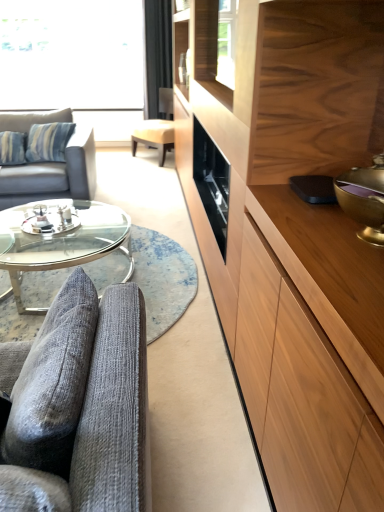
In order to face wooden cabinet at right, should I rotate leftwards or rightwards?

Turn right approximately 5.793 degrees to face it.

Measure the distance between blue striped fabric couch at left, marked as the 1th studio couch in a left-to-right arrangement, and camera.

The depth of blue striped fabric couch at left, marked as the 1th studio couch in a left-to-right arrangement, is 3.53 meters.

Find the location of a particular element. transparent glass coffee table at lower left is located at coordinates (60, 239).

I want to click on light brown leather swivel chair at center, so click(x=157, y=128).

Where is `textured gray couch at lower left, which is the 2th studio couch in back-to-front order`? The image size is (384, 512). textured gray couch at lower left, which is the 2th studio couch in back-to-front order is located at coordinates (79, 406).

Identify the location of wooden cabinet at right. Image resolution: width=384 pixels, height=512 pixels. (294, 234).

Is point (86, 126) positioned behind point (42, 53)?

No, (86, 126) is in front of (42, 53).

Based on the photo, could you tell me if blue striped fabric couch at left, arranged as the 1th studio couch when viewed from the top, is turned towards transparent glass window at upper left?

No, blue striped fabric couch at left, arranged as the 1th studio couch when viewed from the top, does not turn towards transparent glass window at upper left.

Where is `window above the blue striped fabric couch at left, which ranks as the first studio couch in back-to-front order (from the image's perspective)`? Image resolution: width=384 pixels, height=512 pixels. window above the blue striped fabric couch at left, which ranks as the first studio couch in back-to-front order (from the image's perspective) is located at coordinates (71, 54).

How different are the orientations of blue striped fabric couch at left, the 2th studio couch when ordered from front to back, and transparent glass window at upper left in degrees?

There is a 1.3-degree angle between the facing directions of blue striped fabric couch at left, the 2th studio couch when ordered from front to back, and transparent glass window at upper left.

Is point (154, 92) more distant than point (67, 97)?

No, (154, 92) is closer to viewer.

From the image's perspective, who appears lower, black fabric curtain at upper center or transparent glass window at upper left?

black fabric curtain at upper center.

Considering the sizes of black fabric curtain at upper center and transparent glass window at upper left in the image, is black fabric curtain at upper center wider or thinner than transparent glass window at upper left?

Considering their sizes, black fabric curtain at upper center looks slimmer than transparent glass window at upper left.

How different are the orientations of black fabric curtain at upper center and transparent glass window at upper left in degrees?

There is a 0.219-degree angle between the facing directions of black fabric curtain at upper center and transparent glass window at upper left.

Between light brown leather swivel chair at center and textured gray couch at lower left, arranged as the 2th studio couch when viewed from the left, which one has larger width?

light brown leather swivel chair at center.

The height and width of the screenshot is (512, 384). Find the location of `studio couch that is the 1st one when counting leftward from the light brown leather swivel chair at center`. studio couch that is the 1st one when counting leftward from the light brown leather swivel chair at center is located at coordinates (79, 406).

Is point (144, 122) less distant than point (59, 458)?

No, (144, 122) is behind (59, 458).

From the picture: Based on their positions, is light brown leather swivel chair at center located to the left or right of textured gray couch at lower left, which is the 2th studio couch in back-to-front order?

Based on their positions, light brown leather swivel chair at center is located to the right of textured gray couch at lower left, which is the 2th studio couch in back-to-front order.

Is transparent glass window at upper left located within light brown leather swivel chair at center?

No, transparent glass window at upper left is not surrounded by light brown leather swivel chair at center.

Consider the image. Considering the relative sizes of light brown leather swivel chair at center and transparent glass window at upper left in the image provided, is light brown leather swivel chair at center thinner than transparent glass window at upper left?

In fact, light brown leather swivel chair at center might be wider than transparent glass window at upper left.

The image size is (384, 512). I want to click on swivel chair that appears on the right of transparent glass window at upper left, so click(x=157, y=128).

Is black fabric curtain at upper center located within blue striped fabric couch at left, marked as the 1th studio couch in a left-to-right arrangement?

Actually, black fabric curtain at upper center is outside blue striped fabric couch at left, marked as the 1th studio couch in a left-to-right arrangement.

Does blue striped fabric couch at left, which ranks as the 2th studio couch in bottom-to-top order, have a lesser height compared to black fabric curtain at upper center?

Yes, blue striped fabric couch at left, which ranks as the 2th studio couch in bottom-to-top order, is shorter than black fabric curtain at upper center.

Which object is positioned more to the left, blue striped fabric couch at left, which ranks as the 2th studio couch in bottom-to-top order, or black fabric curtain at upper center?

blue striped fabric couch at left, which ranks as the 2th studio couch in bottom-to-top order, is more to the left.

Is transparent glass coffee table at lower left not near wooden cabinet at right?

transparent glass coffee table at lower left is positioned a significant distance from wooden cabinet at right.

Is point (22, 271) behind point (257, 205)?

Yes.

From a real-world perspective, which object rests below the other?

In real-world perspective, transparent glass coffee table at lower left is lower.

Between point (124, 268) and point (87, 38), which one is positioned behind?

The point (87, 38) is behind.

Can you confirm if clear glass coffee table at center is shorter than transparent glass window at upper left?

Indeed, clear glass coffee table at center has a lesser height compared to transparent glass window at upper left.

Is clear glass coffee table at center inside or outside of transparent glass window at upper left?

clear glass coffee table at center is spatially situated outside transparent glass window at upper left.

Locate an element on the screen. This screenshot has height=512, width=384. the 1st studio couch below the transparent glass window at upper left (from the image's perspective) is located at coordinates (54, 174).

The width and height of the screenshot is (384, 512). Find the location of `window above the black fabric curtain at upper center (from the image's perspective)`. window above the black fabric curtain at upper center (from the image's perspective) is located at coordinates (71, 54).

Looking at the image, which one is located closer to transparent glass coffee table at lower left, black fabric curtain at upper center or textured gray couch at lower left, arranged as the 1th studio couch when viewed from the right?

textured gray couch at lower left, arranged as the 1th studio couch when viewed from the right, is closer to transparent glass coffee table at lower left.

Based on their spatial positions, is clear glass coffee table at center or wooden cabinet at right closer to textured gray couch at lower left, the first studio couch when ordered from bottom to top?

Based on the image, wooden cabinet at right appears to be nearer to textured gray couch at lower left, the first studio couch when ordered from bottom to top.

Looking at the image, which one is located closer to blue striped fabric couch at left, marked as the 1th studio couch in a left-to-right arrangement, wooden cabinet at right or clear glass coffee table at center?

clear glass coffee table at center is positioned closer to the anchor blue striped fabric couch at left, marked as the 1th studio couch in a left-to-right arrangement.

Estimate the real-world distances between objects in this image. Which object is further from blue striped fabric couch at left, which ranks as the 2th studio couch in bottom-to-top order, black fabric curtain at upper center or transparent glass coffee table at lower left?

black fabric curtain at upper center lies further to blue striped fabric couch at left, which ranks as the 2th studio couch in bottom-to-top order, than the other object.

From the image, which object appears to be farther from clear glass coffee table at center, blue striped fabric couch at left, arranged as the 1th studio couch when viewed from the top, or transparent glass window at upper left?

transparent glass window at upper left is positioned further to the anchor clear glass coffee table at center.

Based on the photo, based on their spatial positions, is textured gray couch at lower left, arranged as the 2th studio couch when viewed from the left, or black fabric curtain at upper center further from transparent glass window at upper left?

The object further to transparent glass window at upper left is textured gray couch at lower left, arranged as the 2th studio couch when viewed from the left.

Estimate the real-world distances between objects in this image. Which object is closer to wooden cabinet at right, light brown leather swivel chair at center or textured gray couch at lower left, the 1th studio couch in the front-to-back sequence?

Among the two, textured gray couch at lower left, the 1th studio couch in the front-to-back sequence, is located nearer to wooden cabinet at right.

Estimate the real-world distances between objects in this image. Which object is further from black fabric curtain at upper center, clear glass coffee table at center or light brown leather swivel chair at center?

clear glass coffee table at center lies further to black fabric curtain at upper center than the other object.

Locate an element on the screen. The width and height of the screenshot is (384, 512). swivel chair between light brown wood drawer at right and transparent glass window at upper left in the front-back direction is located at coordinates (157, 128).

Image resolution: width=384 pixels, height=512 pixels. In order to click on coffee table between wooden cabinet at right and transparent glass window at upper left from front to back in this screenshot , I will do `click(60, 239)`.

Locate an element on the screen. This screenshot has width=384, height=512. studio couch between light brown wood drawer at right and light brown leather swivel chair at center in the front-back direction is located at coordinates (54, 174).

Where is `coffee table positioned between clear glass coffee table at center and blue striped fabric couch at left, arranged as the 1th studio couch when viewed from the top, from near to far`? The width and height of the screenshot is (384, 512). coffee table positioned between clear glass coffee table at center and blue striped fabric couch at left, arranged as the 1th studio couch when viewed from the top, from near to far is located at coordinates (60, 239).